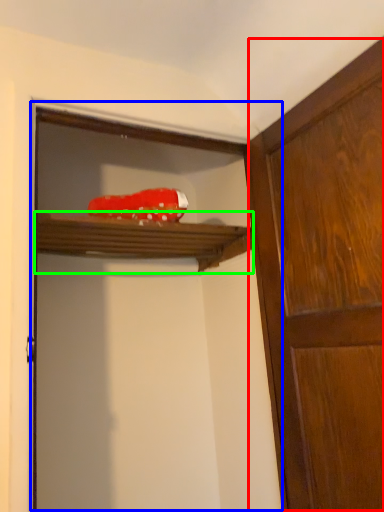
Question: Considering the real-world distances, which object is farthest from cabinetry (highlighted by a red box)? screen door (highlighted by a blue box) or shelf (highlighted by a green box)?

Choices:
 (A) screen door
 (B) shelf

Answer: (B)